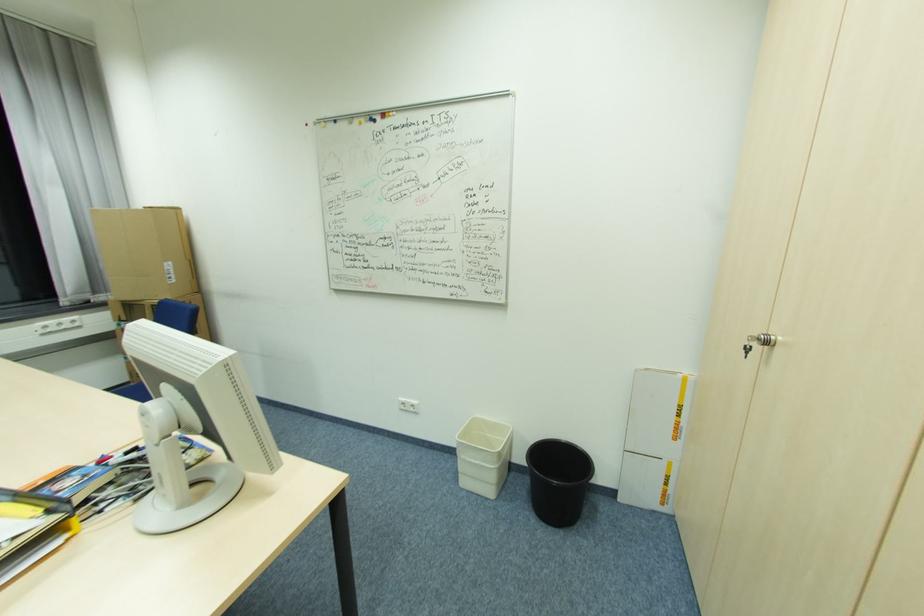
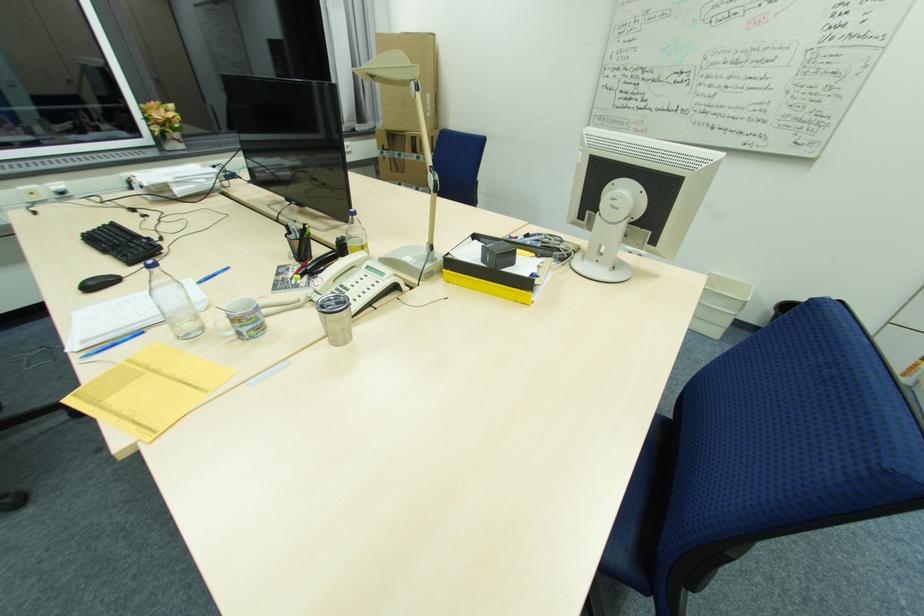
Which direction would the cameraman need to move to produce the second image?

The cameraman walked toward left, backward.